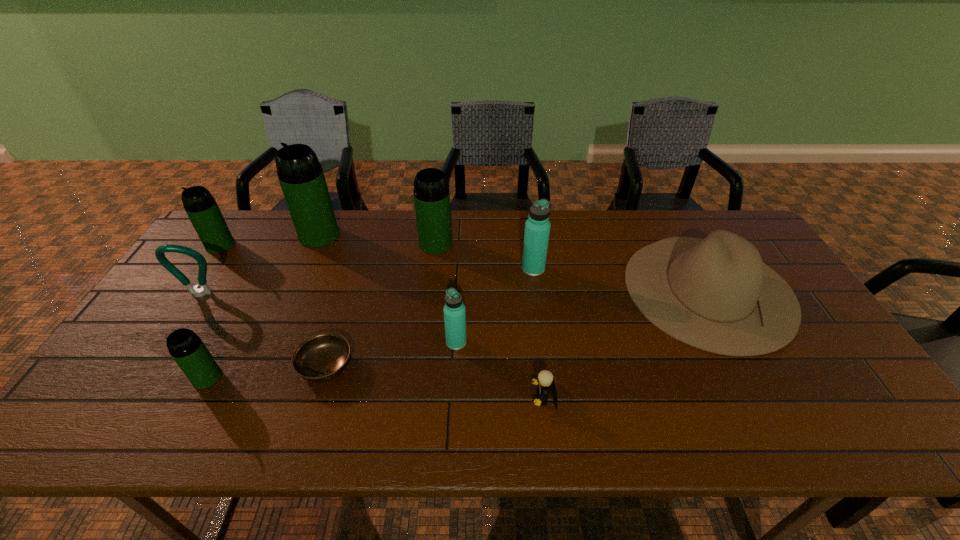
At what (x,y) coordinates should I click in order to perform the action: click on free spot between the fourth object from left to right and the sixth object from left to right. Please return your answer as a coordinate pair (x, y). Image resolution: width=960 pixels, height=540 pixels. Looking at the image, I should click on (377, 240).

I want to click on vacant space that's between the green bottle opener and the rightmost green thermos bottle, so click(318, 269).

You are a GUI agent. You are given a task and a screenshot of the screen. Output one action in this format:
    pyautogui.click(x=<x>, y=<y>)
    Task: Click on the vacant space in between the tallest object and the fifth object from left to right
    The height and width of the screenshot is (540, 960).
    Given the screenshot: What is the action you would take?
    pyautogui.click(x=323, y=301)

The image size is (960, 540). What are the coordinates of `empty location between the brown sombrero and the bigger aqua thermos bottle` in the screenshot? It's located at tap(621, 279).

The width and height of the screenshot is (960, 540). Identify the location of free space between the fifth object from right to left and the farther aqua thermos bottle. (485, 256).

In order to click on empty location between the soup bowl and the Lego in this screenshot , I will do `click(435, 382)`.

You are a GUI agent. You are given a task and a screenshot of the screen. Output one action in this format:
    pyautogui.click(x=<x>, y=<y>)
    Task: Click on the free space between the ninth tallest object and the green bottle opener
    The width and height of the screenshot is (960, 540).
    Given the screenshot: What is the action you would take?
    pyautogui.click(x=372, y=347)

Find the location of `vacant space that is in between the brown sombrero and the bigger aqua thermos bottle`. vacant space that is in between the brown sombrero and the bigger aqua thermos bottle is located at coordinates (621, 279).

Locate an element on the screen. free point between the soup bowl and the second thermos bottle from left to right is located at coordinates (266, 372).

Find the location of a particular element. The image size is (960, 540). object that ranks as the second closest to the nearest green thermos bottle is located at coordinates (160, 250).